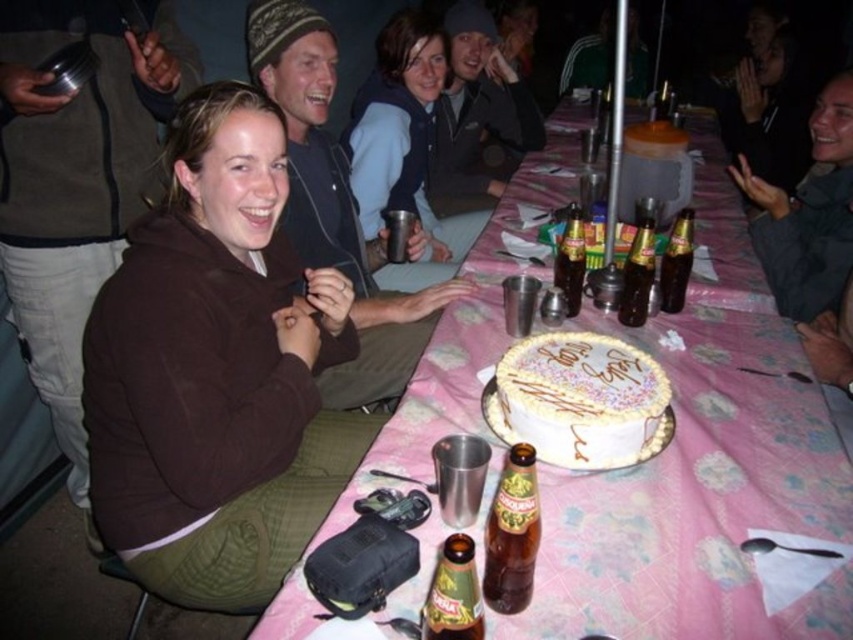
You are standing at the point (x=646, y=243) and want to greet someone who is 5.28 feet away from you. Can you estimate how far you need to walk to reach them?

You need to walk 5.28 feet to reach the person since they are 5.28 feet away from you at point (x=646, y=243).

You are a guest at this event and want to grab a drink from the table. The white frosted cake at center is in your way. Can you reach the green glass bottle at center without moving the cake?

The white frosted cake at center is positioned over green glass bottle at center, so the cake is covering the bottle. You cannot reach the green glass bottle at center without moving the cake.

You are a guest at this event and want to reach for the translucent glass bottle at center. Considering your arm can extend 2.5 feet, can you comfortably reach it?

The translucent glass bottle at center is 5.47 feet away from you, which is beyond your arm extension of 2.5 feet. You cannot comfortably reach it.